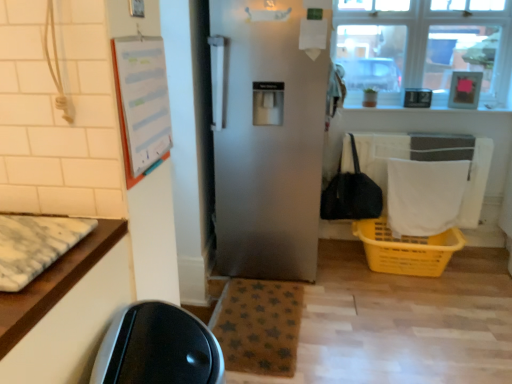
Identify the location of empty space that is ontop of brown star-patterned mat at lower center, which ranks as the second mat in left-to-right order (from a real-world perspective). The image size is (512, 384). (249, 320).